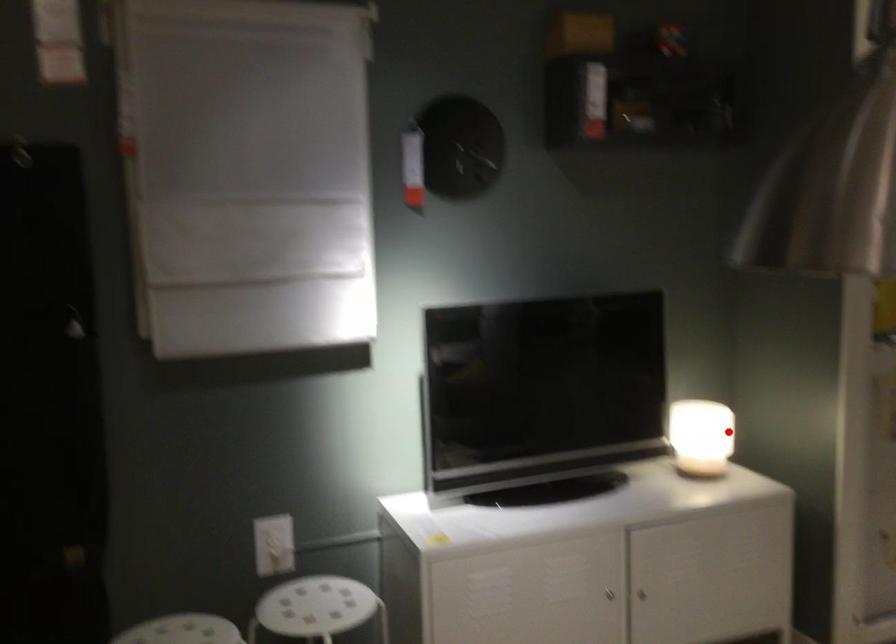
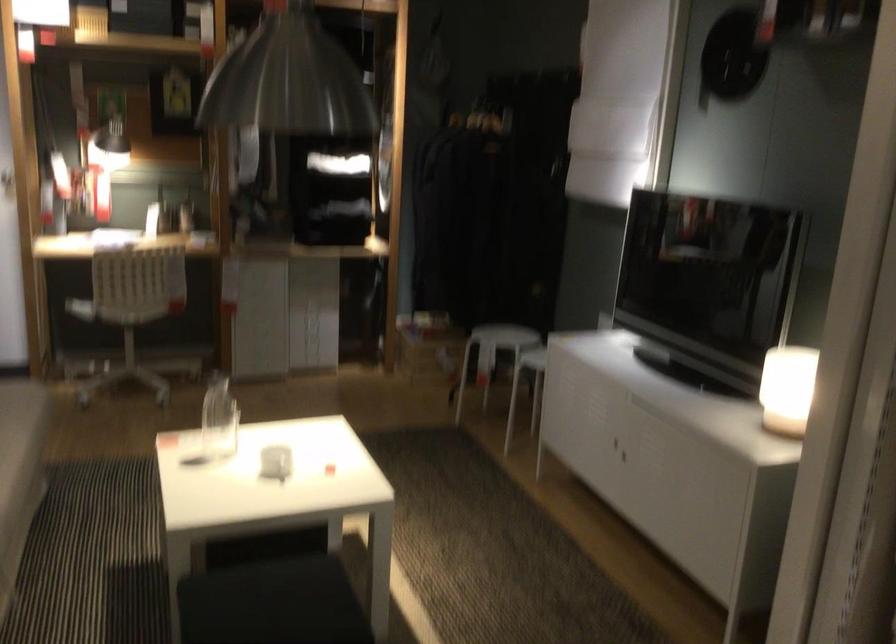
Locate, in the second image, the point that corresponds to the highlighted location in the first image.

(788, 380)